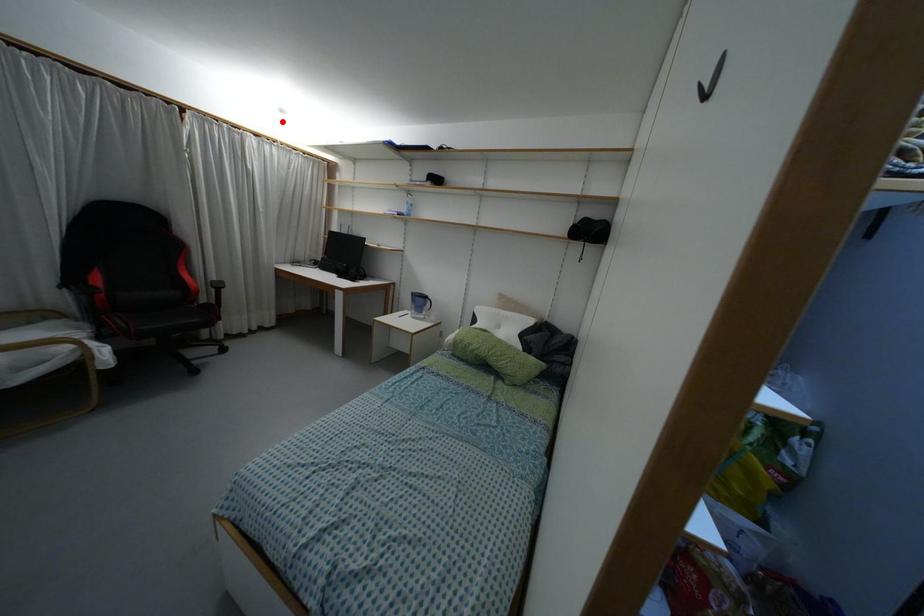
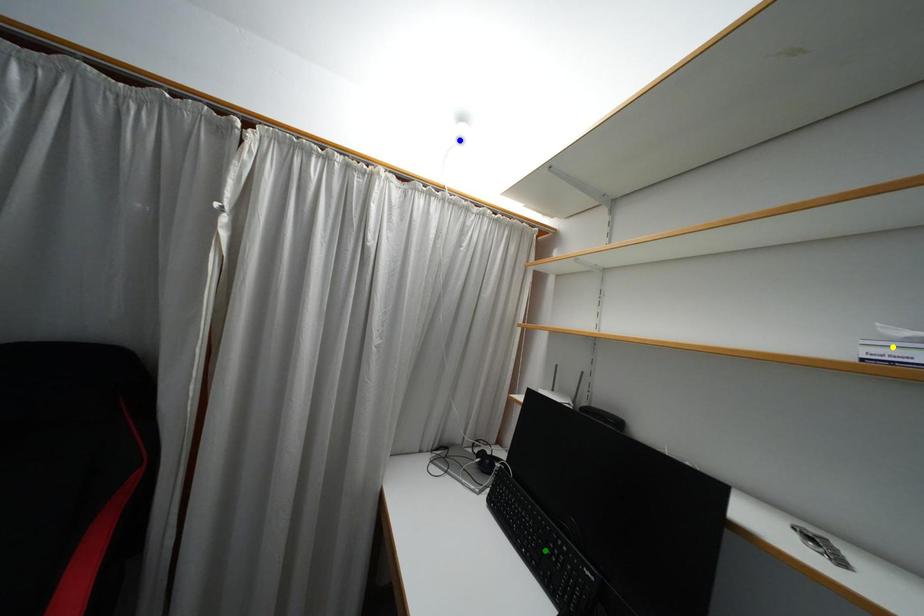
Question: I am providing you with two images of the same scene from different viewpoints. A red point is marked on the first image. You are given multiple points on the second image. Which point in image 2 represents the same 3d spot as the red point in image 1?

Choices:
 (A) green point
 (B) blue point
 (C) yellow point

Answer: (B)